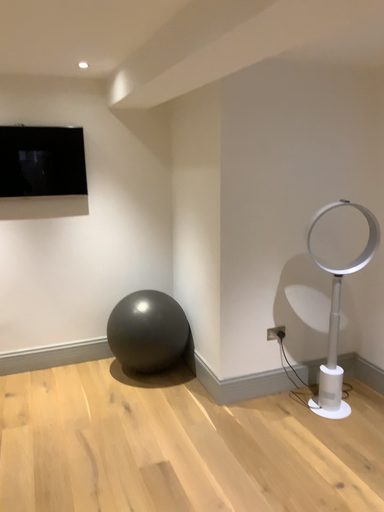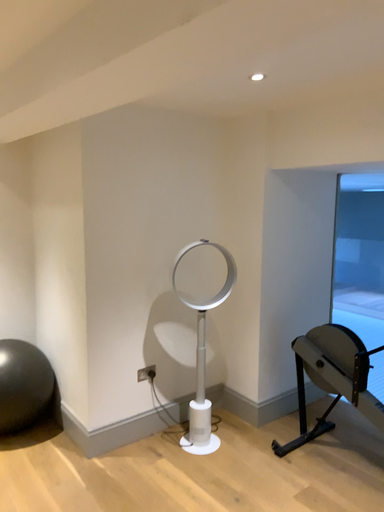
Question: Which way did the camera rotate in the video?

Choices:
 (A) rotated left
 (B) rotated right

Answer: (B)